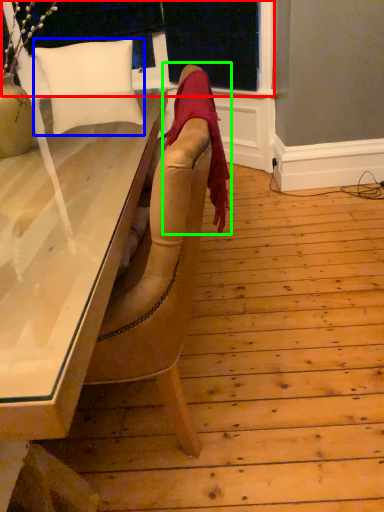
Question: Based on their relative distances, which object is nearer to window frame (highlighted by a red box)? Choose from pillow (highlighted by a blue box) and blanket (highlighted by a green box).

Choices:
 (A) pillow
 (B) blanket

Answer: (A)